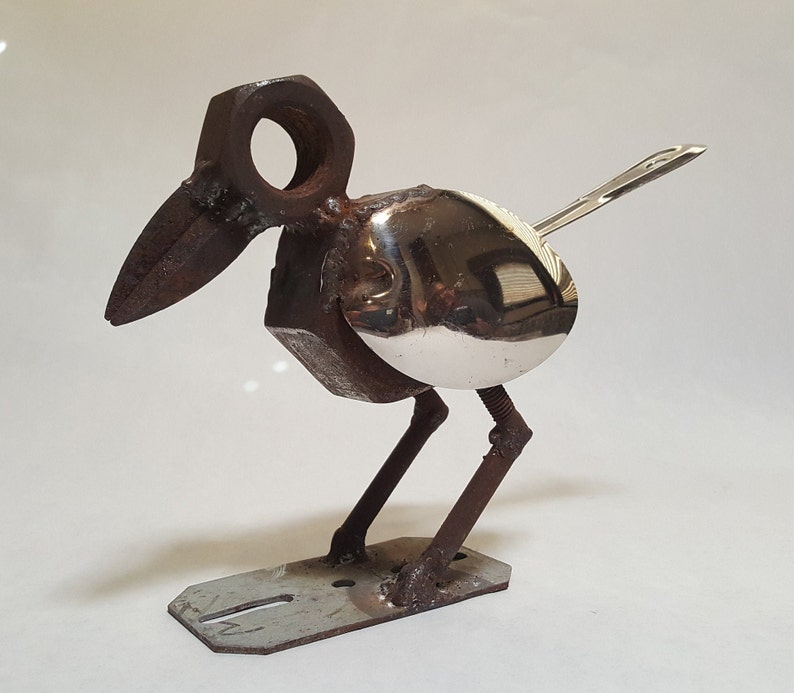
Identify the location of statue. The height and width of the screenshot is (693, 794). (453, 369).